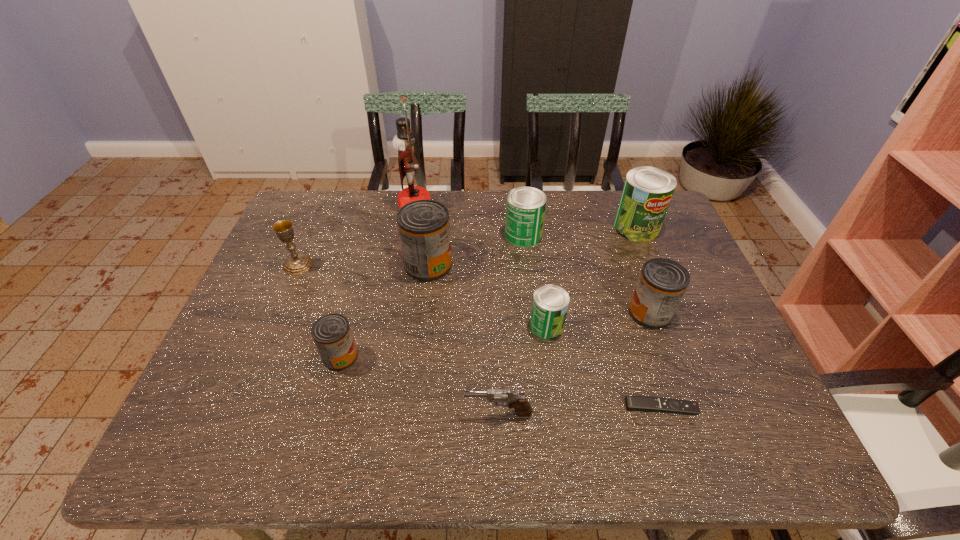
Identify the location of free space between the pistol and the shortest object. The width and height of the screenshot is (960, 540). (580, 410).

What are the coordinates of `vacant area that lies between the second biggest green can and the nutcracker` in the screenshot? It's located at (469, 221).

This screenshot has width=960, height=540. I want to click on free space between the nutcracker and the ninth tallest object, so click(457, 310).

The image size is (960, 540). Identify the location of free area in between the rightmost red can and the remote control. (656, 360).

Identify the location of vacant space that is in between the second smallest green can and the farthest red can. (476, 250).

Identify which object is the second closest to the tallest object. Please provide its 2D coordinates. Your answer should be formatted as a tuple, i.e. [(x, y)], where the tuple contains the x and y coordinates of a point satisfying the conditions above.

[(525, 206)]

This screenshot has width=960, height=540. I want to click on object that is the ninth closest to the second biggest green can, so pyautogui.click(x=297, y=263).

Locate which can ranks fourth in proximity to the biggest green can. Please provide its 2D coordinates. Your answer should be formatted as a tuple, i.e. [(x, y)], where the tuple contains the x and y coordinates of a point satisfying the conditions above.

[(424, 229)]

Identify which can is the third nearest to the gray pistol. Please provide its 2D coordinates. Your answer should be formatted as a tuple, i.e. [(x, y)], where the tuple contains the x and y coordinates of a point satisfying the conditions above.

[(662, 283)]

Where is `red can that stands as the third closest to the tallest object`? The height and width of the screenshot is (540, 960). red can that stands as the third closest to the tallest object is located at coordinates (662, 283).